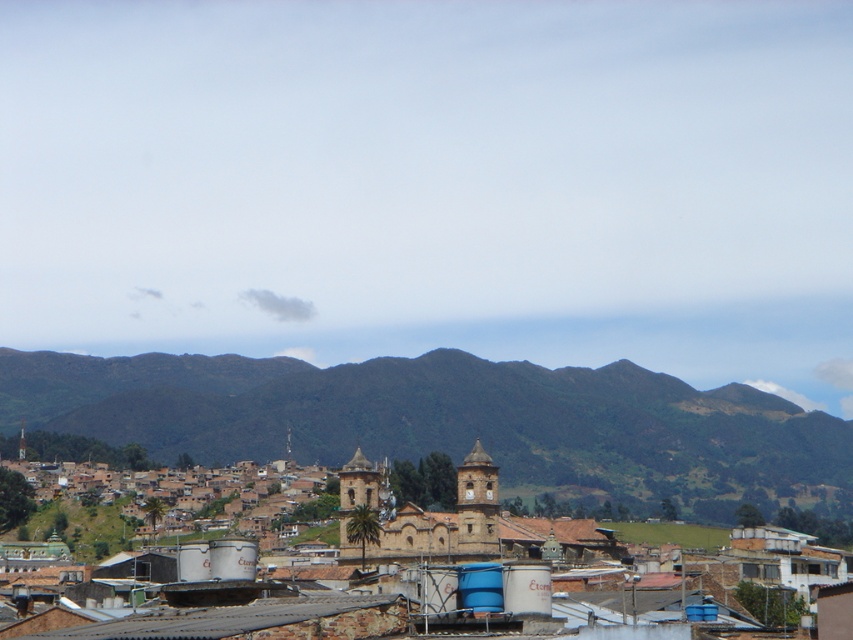
Is the position of green grassy mountain at center more distant than that of brown stone church at center?

That is True.

Between point (250, 356) and point (379, 557), which one is positioned in front?

Positioned in front is point (379, 557).

Locate an element on the screen. The image size is (853, 640). green grassy mountain at center is located at coordinates pos(454,420).